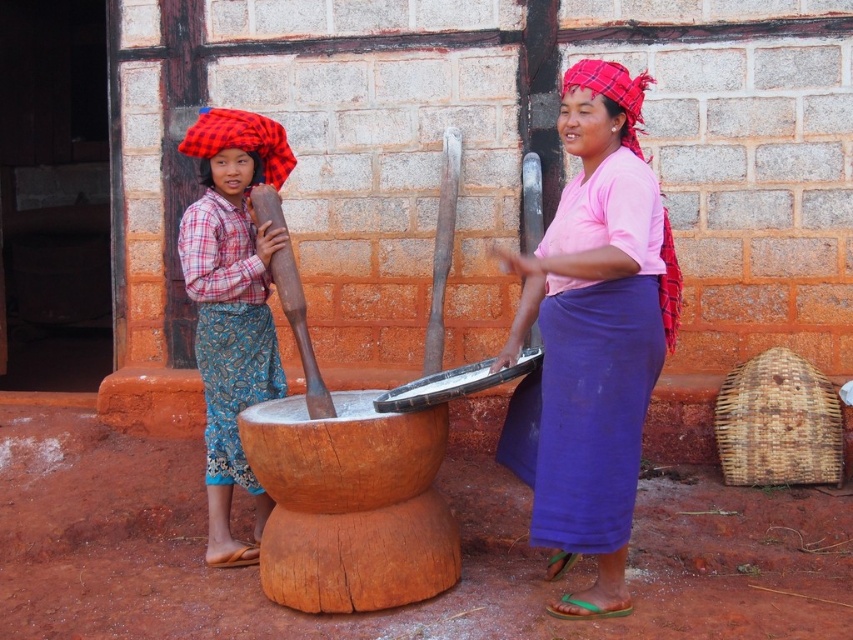
Looking at the scene, where is the pink fabric skirt at center located in relation to the plaid fabric headscarf at left?

The pink fabric skirt at center is to the right of the plaid fabric headscarf at left.

Based on the scene described, which object has a larger size between the pink fabric skirt at center and the plaid fabric headscarf at left?

The pink fabric skirt at center is bigger than the plaid fabric headscarf at left.

What are the coordinates of the pink fabric skirt at center?

The pink fabric skirt at center is located at coordinates (x=592, y=337).